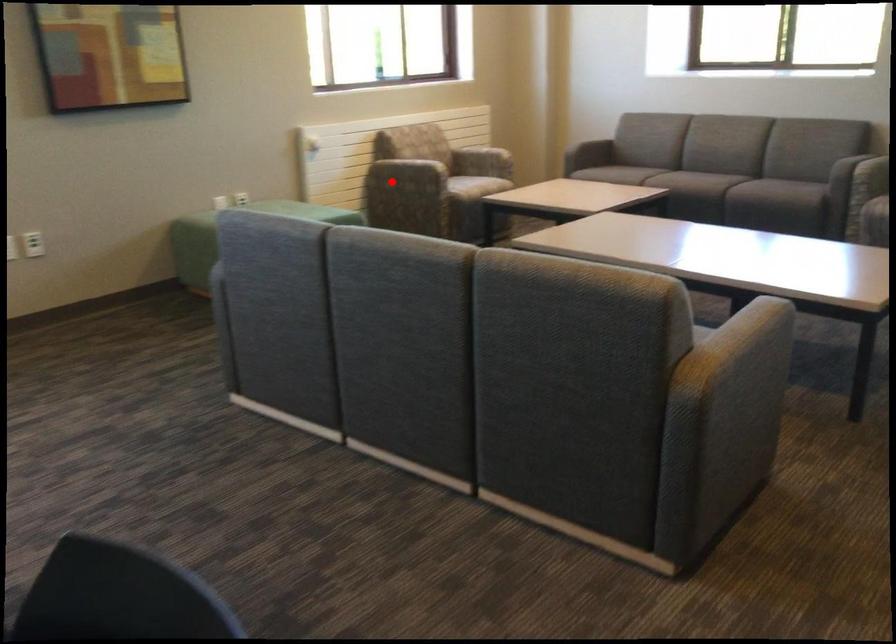
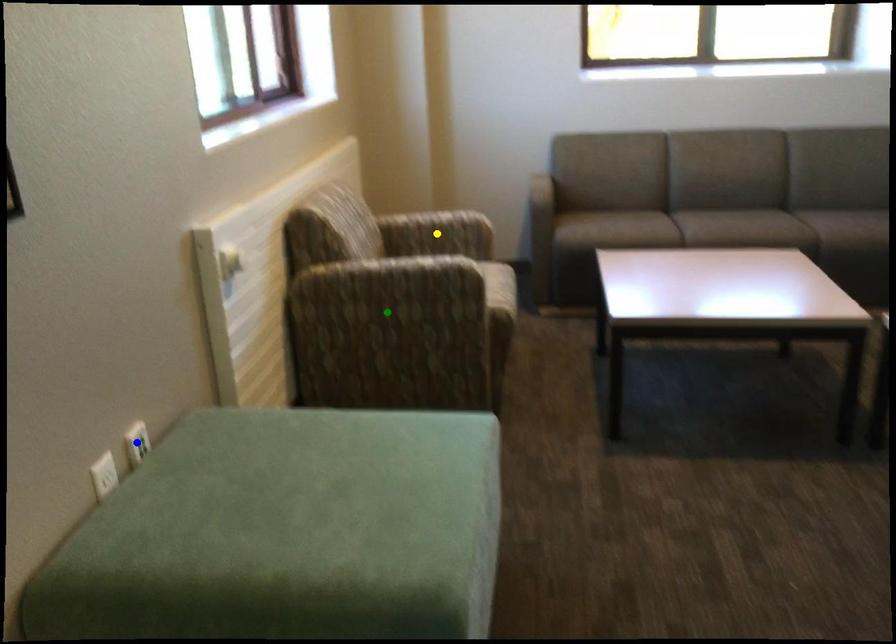
Question: I am providing you with two images of the same scene from different viewpoints. A red point is marked on the first image. You are given multiple points on the second image. Which spot in image 2 lines up with the point in image 1?

Choices:
 (A) blue point
 (B) yellow point
 (C) green point

Answer: (C)